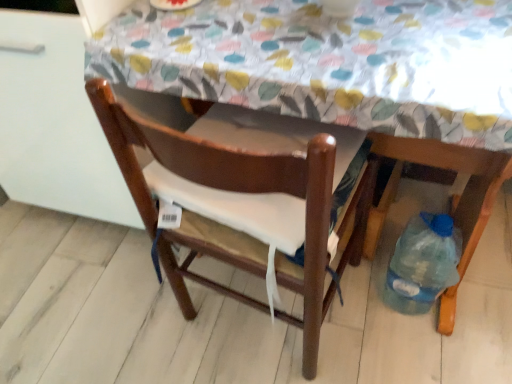
Identify the location of blank space to the left of wooden table at center. Image resolution: width=512 pixels, height=384 pixels. (131, 313).